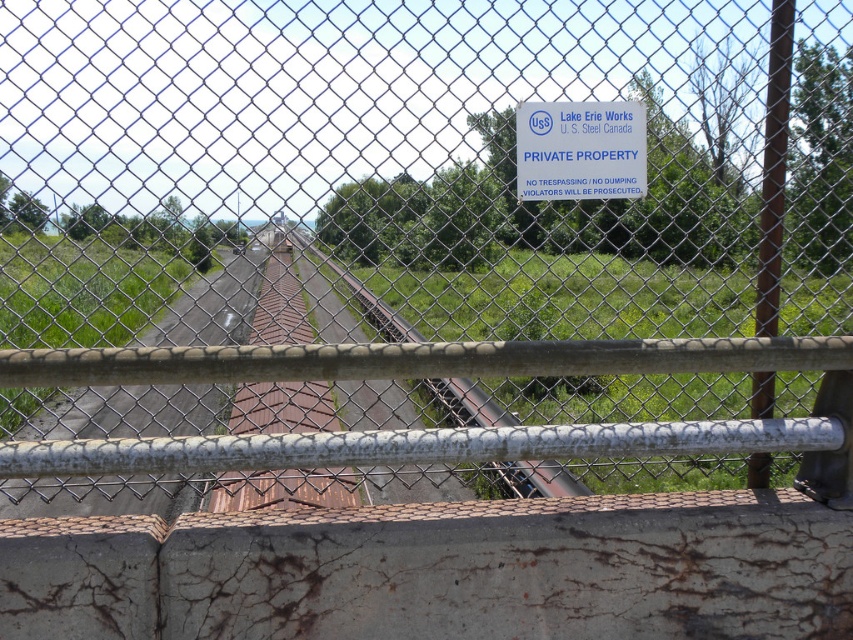
Which is more to the left, blue plastic sign at upper center or brown corrugated metal train track at center?

brown corrugated metal train track at center is more to the left.

Does blue plastic sign at upper center have a lesser width compared to brown corrugated metal train track at center?

Yes.

Does point (581, 120) come in front of point (511, 416)?

Yes.

Find the location of `blue plastic sign at upper center`. blue plastic sign at upper center is located at coordinates (579, 148).